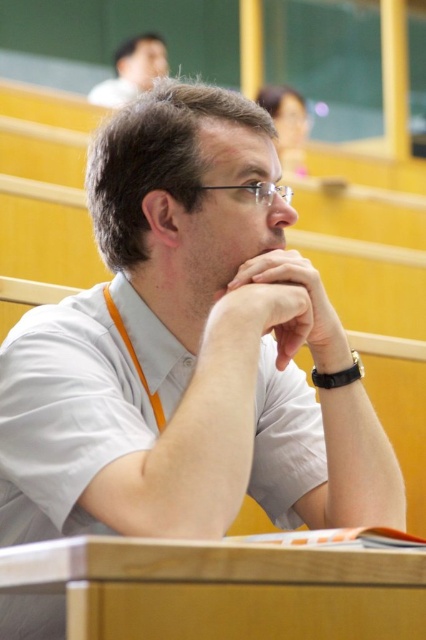
Question: Which of the following is the farthest from the observer?

Choices:
 (A) matte skin hand at center
 (B) matte white shirt at upper center

Answer: (B)

Question: Does matte skin hand at center come behind matte white shirt at upper center?

Choices:
 (A) yes
 (B) no

Answer: (B)

Question: Does matte skin hand at center have a smaller size compared to matte white shirt at upper center?

Choices:
 (A) yes
 (B) no

Answer: (A)

Question: Among these points, which one is farthest from the camera?

Choices:
 (A) (339, 352)
 (B) (108, 104)

Answer: (B)

Question: Is matte skin hand at center bigger than matte white shirt at upper center?

Choices:
 (A) yes
 (B) no

Answer: (B)